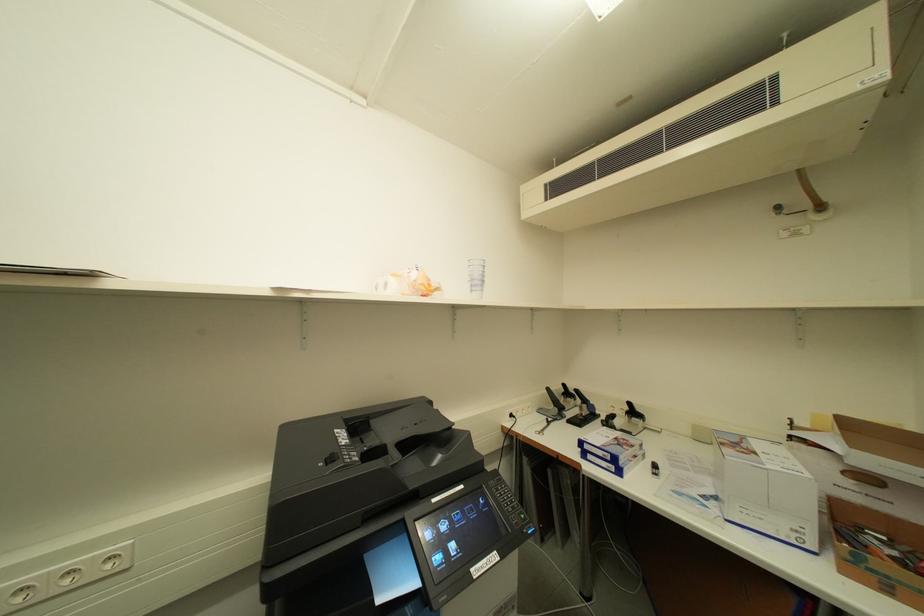
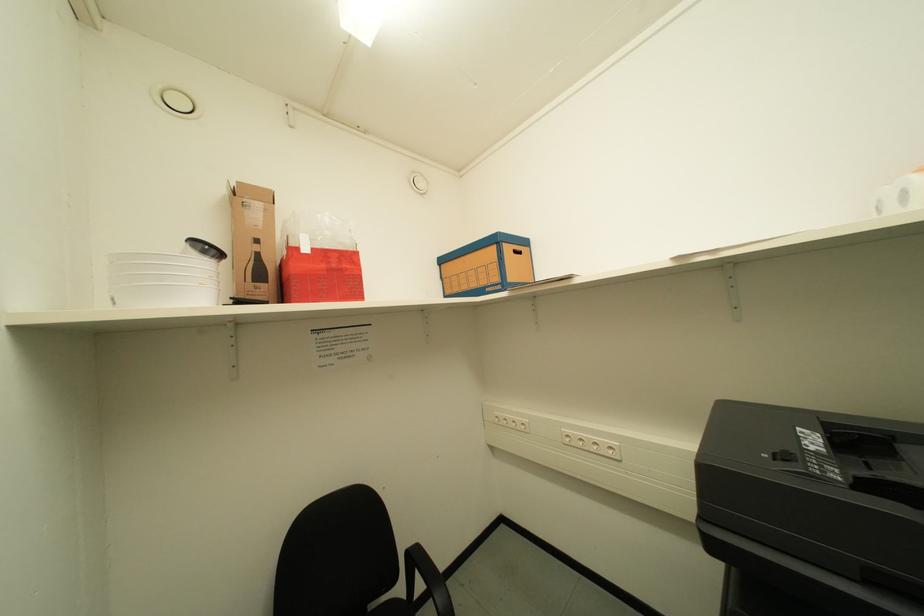
Question: The camera is either moving clockwise (left) or counter-clockwise (right) around the object. The first image is from the beginning of the video and the second image is from the end. Is the camera moving left or right when shooting the video?

Choices:
 (A) Left
 (B) Right

Answer: (B)